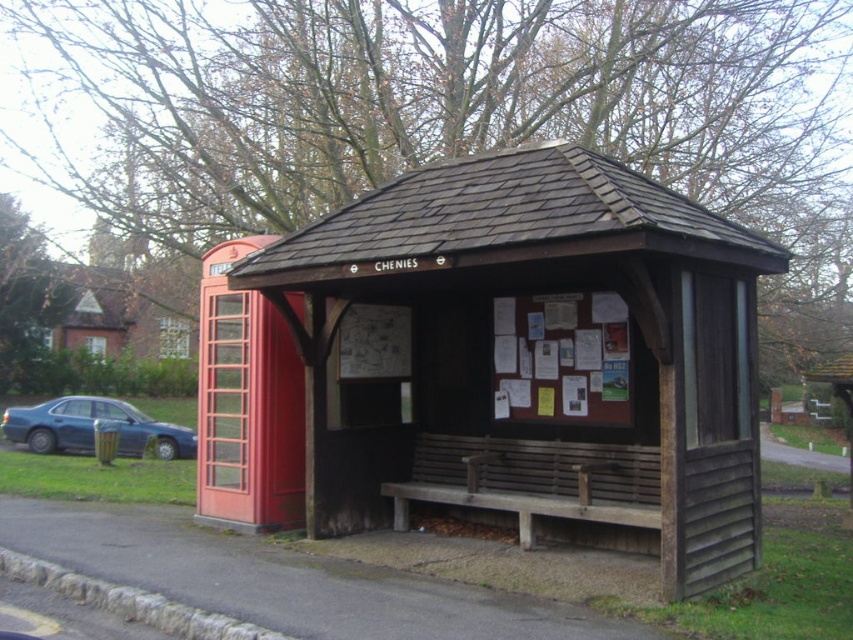
Which is more to the right, wooden bench at center or matte blue sedan at left?

wooden bench at center

Is wooden bench at center further to the viewer compared to matte blue sedan at left?

No, wooden bench at center is in front of matte blue sedan at left.

Which is behind, point (463, 449) or point (25, 410)?

Positioned behind is point (25, 410).

Identify the location of wooden bench at center. (532, 355).

Is weathered wood bench at center to the right of matte blue sedan at left from the viewer's perspective?

Yes, weathered wood bench at center is to the right of matte blue sedan at left.

Is weathered wood bench at center smaller than matte blue sedan at left?

Indeed, weathered wood bench at center has a smaller size compared to matte blue sedan at left.

Does point (527, 520) come in front of point (38, 428)?

That is True.

Find the location of a particular element. The width and height of the screenshot is (853, 640). weathered wood bench at center is located at coordinates point(532,481).

Between wooden bench at center and weathered wood bench at center, which one has more height?

wooden bench at center

Locate an element on the screen. The width and height of the screenshot is (853, 640). wooden bench at center is located at coordinates [x=532, y=355].